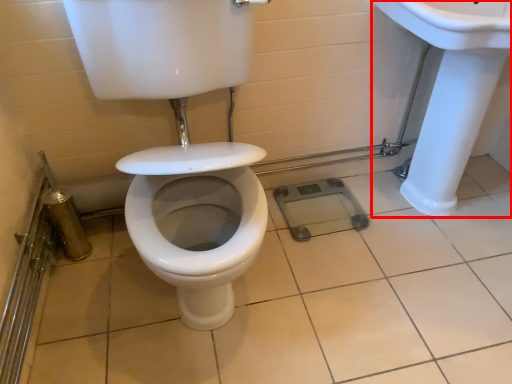
Question: From the image's perspective, what is the correct spatial relationship of sink (annotated by the red box) in relation to ceramic tile?

Choices:
 (A) below
 (B) above

Answer: (B)